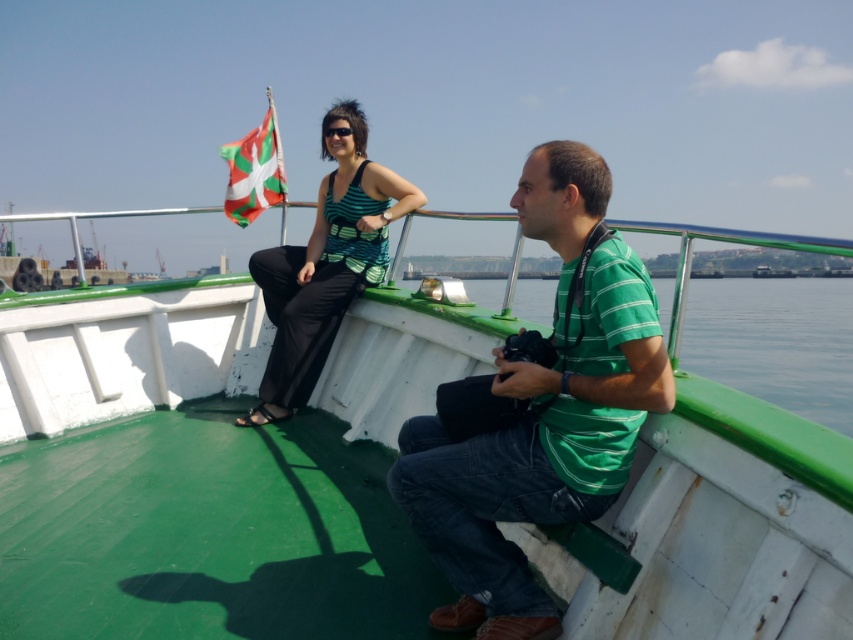
You are a photographer on the boat deck and want to capture both the green striped shirt at center and the white and green fabric flag at upper left in a single frame. Which object should you focus on first to ensure both are in the frame?

The green striped shirt at center is smaller than the white and green fabric flag at upper left, so you should focus on the white and green fabric flag at upper left first to ensure both fit in the frame.

You are standing on the deck of the boat and want to take a photo of the green matte boat at center and the matte green tank top at upper center. Which object should you point the camera towards first if you want to capture both in the frame without moving the camera?

The green matte boat at center is to the left of the matte green tank top at upper center, so you should point the camera towards the green matte boat at center first to include both in the frame.

You are standing on the deck of the boat and want to find the point at coordinates (715, 508). According to the image, where exactly is this point located?

The point at coordinates (715, 508) is located on the green matte boat at center.